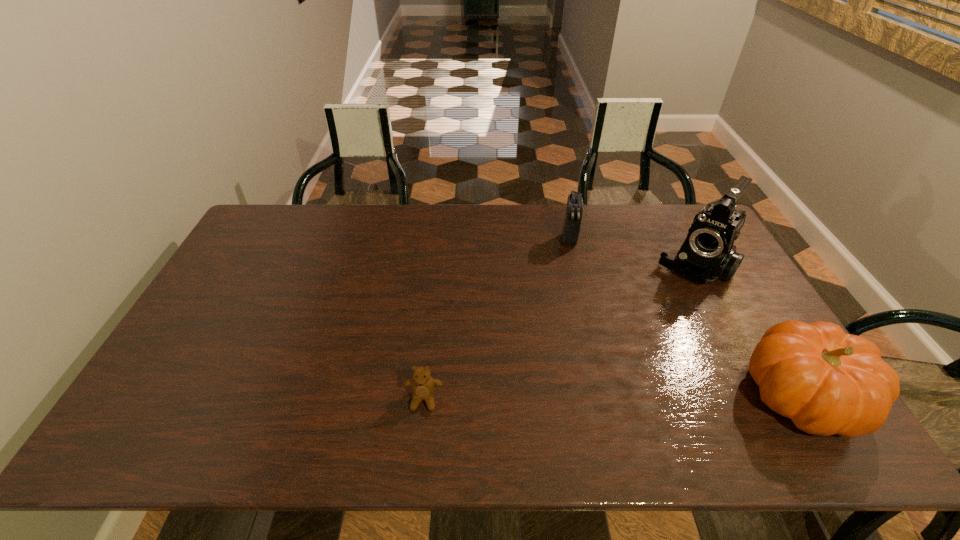
The width and height of the screenshot is (960, 540). Find the location of `free spot on the desktop that is between the teddy bear and the pumpkin and is positioned on the lens mount of the camcorder`. free spot on the desktop that is between the teddy bear and the pumpkin and is positioned on the lens mount of the camcorder is located at coordinates (588, 397).

Locate an element on the screen. The image size is (960, 540). free spot on the desktop that is between the shortest object and the pumpkin and is positioned with the zip open on the third tallest object is located at coordinates (572, 397).